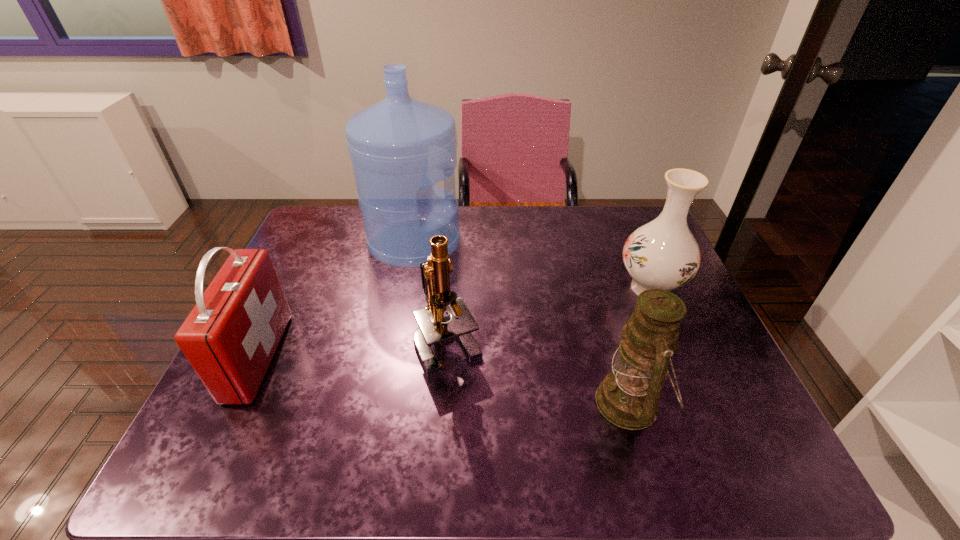
Identify the location of free space that is in between the vase and the microscope. (549, 315).

Find the location of a particular element. free point between the tallest object and the vase is located at coordinates (533, 265).

Locate an element on the screen. The width and height of the screenshot is (960, 540). vacant space in between the vase and the microscope is located at coordinates (549, 315).

Identify the location of vacant space in between the tallest object and the oil lamp. (522, 322).

Locate an element on the screen. The width and height of the screenshot is (960, 540). object that is the third closest to the leftmost object is located at coordinates (628, 397).

The image size is (960, 540). Find the location of `object that is the closest to the vase`. object that is the closest to the vase is located at coordinates (628, 397).

I want to click on vacant region that satisfies the following two spatial constraints: 1. on the side of the tallest object with the handle; 2. on the back side of the oil lamp, so click(385, 402).

Find the location of `free space that satisfies the following two spatial constraints: 1. on the side of the vase with the handle; 2. on the right side of the water jug`. free space that satisfies the following two spatial constraints: 1. on the side of the vase with the handle; 2. on the right side of the water jug is located at coordinates (406, 288).

This screenshot has height=540, width=960. I want to click on free point that satisfies the following two spatial constraints: 1. at the eyepiece of the oil lamp; 2. on the left side of the microscope, so click(444, 402).

In order to click on free location that satisfies the following two spatial constraints: 1. on the front face of the first-aid kit; 2. on the back side of the oil lamp in this screenshot , I will do pos(237,402).